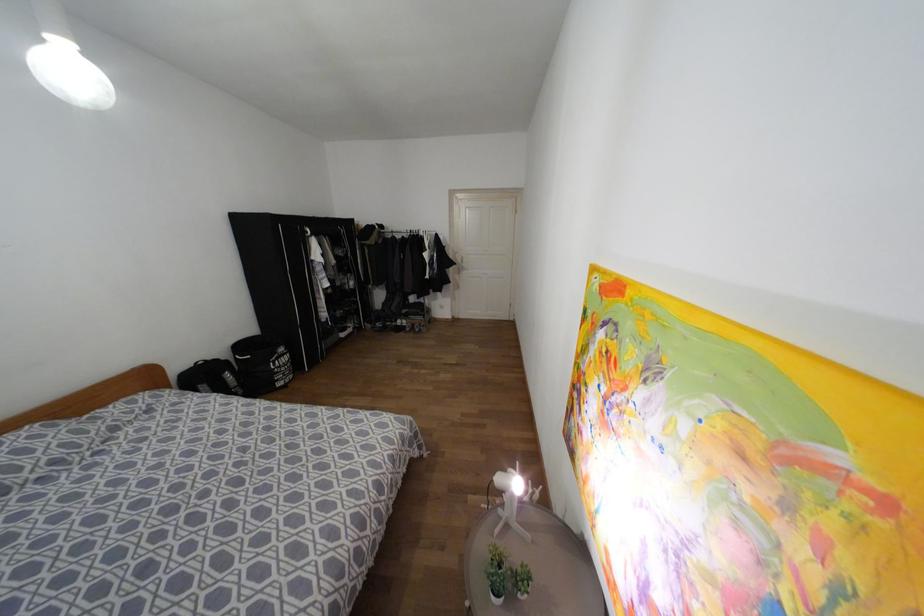
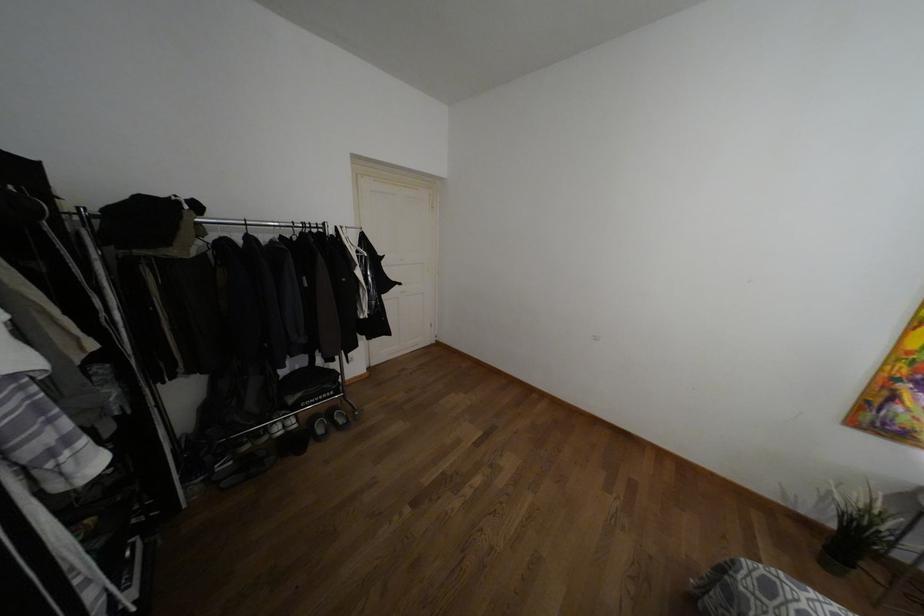
Find the pixel in the second image that matches [403,310] in the first image.

(290, 399)